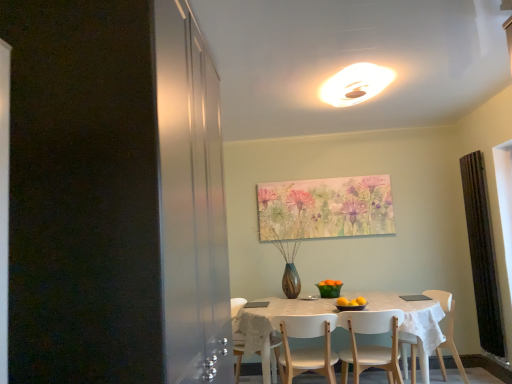
What do you see at coordinates (413, 322) in the screenshot?
I see `white glossy table at center` at bounding box center [413, 322].

Describe the element at coordinates (371, 345) in the screenshot. The width and height of the screenshot is (512, 384). I see `white matte chair at lower center, which appears as the 2th chair when viewed from the right` at that location.

Identify the location of black textured curtain at right. This screenshot has width=512, height=384. (482, 254).

What is the approximate height of white wood chair at center, the 3th chair in the right-to-left sequence?

white wood chair at center, the 3th chair in the right-to-left sequence, is 24.96 inches in height.

I want to click on white glossy table at center, so click(x=413, y=322).

Which object is thinner, white matte chair at lower center, which appears as the 2th chair when viewed from the right, or white glossy table at center?

Thinner between the two is white matte chair at lower center, which appears as the 2th chair when viewed from the right.

Does point (392, 327) lie behind point (268, 359)?

Yes, point (392, 327) is farther from viewer.

Is white matte chair at lower center, marked as the 2th chair in a left-to-right arrangement, to the left or to the right of white glossy table at center in the image?

white matte chair at lower center, marked as the 2th chair in a left-to-right arrangement, is to the right of white glossy table at center.

From a real-world perspective, is white matte chair at lower center, marked as the 2th chair in a left-to-right arrangement, positioned over white glossy table at center based on gravity?

Correct, in the physical world, white matte chair at lower center, marked as the 2th chair in a left-to-right arrangement, is higher than white glossy table at center.

Is white matte chair at lower right, acting as the third chair starting from the left, aimed at white glossy light fixture at upper center?

A: No.

From a real-world perspective, relative to white glossy light fixture at upper center, is white matte chair at lower right, acting as the 1th chair starting from the right, vertically above or below?

From a real-world perspective, white matte chair at lower right, acting as the 1th chair starting from the right, is physically below white glossy light fixture at upper center.

Which of these two, white matte chair at lower right, acting as the third chair starting from the left, or white glossy light fixture at upper center, is wider?

white glossy light fixture at upper center is wider.

Does white matte chair at lower right, acting as the 1th chair starting from the right, have a larger size compared to white glossy light fixture at upper center?

Correct, white matte chair at lower right, acting as the 1th chair starting from the right, is larger in size than white glossy light fixture at upper center.

From the picture: Between black textured curtain at right and white glossy light fixture at upper center, which one has less height?

white glossy light fixture at upper center.

How different are the orientations of black textured curtain at right and white glossy light fixture at upper center in degrees?

91.5 degrees separate the facing orientations of black textured curtain at right and white glossy light fixture at upper center.

How far apart are black textured curtain at right and white glossy light fixture at upper center?

A distance of 5.77 feet exists between black textured curtain at right and white glossy light fixture at upper center.

Which object is closer to the camera taking this photo, black textured curtain at right or white glossy light fixture at upper center?

white glossy light fixture at upper center is in front.

Can white matte chair at lower right, acting as the 1th chair starting from the right, be found inside white glossy light fixture at upper center?

Definitely not — white matte chair at lower right, acting as the 1th chair starting from the right, is not inside white glossy light fixture at upper center.

From a real-world perspective, is white glossy light fixture at upper center physically above white matte chair at lower right, acting as the third chair starting from the left?

Indeed, from a real-world perspective, white glossy light fixture at upper center stands above white matte chair at lower right, acting as the third chair starting from the left.

Could you measure the distance between white glossy light fixture at upper center and white matte chair at lower right, acting as the third chair starting from the left?

white glossy light fixture at upper center is 1.97 meters away from white matte chair at lower right, acting as the third chair starting from the left.

Does white glossy light fixture at upper center have a greater height compared to white matte chair at lower right, acting as the third chair starting from the left?

In fact, white glossy light fixture at upper center may be shorter than white matte chair at lower right, acting as the third chair starting from the left.

In order to click on the 2nd chair below when counting from the watercolor canvas at upper center (from the image's perspective) in this screenshot , I will do `click(306, 348)`.

Is white wood chair at center, the 3th chair in the right-to-left sequence, aimed at watercolor canvas at upper center?

No, white wood chair at center, the 3th chair in the right-to-left sequence, is not aimed at watercolor canvas at upper center.

Who is smaller, white wood chair at center, the 3th chair in the right-to-left sequence, or watercolor canvas at upper center?

watercolor canvas at upper center.

Which object is positioned more to the left, white wood chair at center, the 3th chair in the right-to-left sequence, or watercolor canvas at upper center?

Positioned to the left is white wood chair at center, the 3th chair in the right-to-left sequence.

From a real-world perspective, who is located lower, white glossy table at center or watercolor canvas at upper center?

In real-world perspective, white glossy table at center is lower.

Is white glossy table at center positioned with its back to watercolor canvas at upper center?

white glossy table at center does not have its back to watercolor canvas at upper center.

Would you say watercolor canvas at upper center is part of white glossy table at center's contents?

Definitely not — watercolor canvas at upper center is not inside white glossy table at center.

Which of these two, white glossy table at center or watercolor canvas at upper center, is bigger?

white glossy table at center.

Considering the relative sizes of watercolor canvas at upper center and white matte chair at lower right, acting as the 1th chair starting from the right, in the image provided, is watercolor canvas at upper center smaller than white matte chair at lower right, acting as the 1th chair starting from the right,?

Yes.

From the watercolor canvas at upper center, count 1st chairs forward and point to it. Please provide its 2D coordinates.

[(447, 331)]

Does watercolor canvas at upper center turn towards white matte chair at lower right, acting as the 1th chair starting from the right?

No, watercolor canvas at upper center does not turn towards white matte chair at lower right, acting as the 1th chair starting from the right.

Between watercolor canvas at upper center and white matte chair at lower right, acting as the third chair starting from the left, which one has less height?

Standing shorter between the two is watercolor canvas at upper center.

Find the location of `chair that is the 3rd object located above the white glossy table at center (from the image's perspective)`. chair that is the 3rd object located above the white glossy table at center (from the image's perspective) is located at coordinates (371, 345).

There is a white glossy light fixture at upper center. Identify the location of the 3rd chair below it (from the image's perspective). This screenshot has width=512, height=384. (447, 331).

In the scene shown: Considering their positions, is watercolor canvas at upper center positioned further to white glossy table at center than white wood chair at center, the 3th chair in the right-to-left sequence?

watercolor canvas at upper center is positioned further to the anchor white glossy table at center.

Which object lies further to the anchor point white glossy table at center, white glossy light fixture at upper center or white wood chair at center, which appears as the 1th chair when viewed from the left?

Among the two, white glossy light fixture at upper center is located further to white glossy table at center.

Which object lies nearer to the anchor point white matte chair at lower right, acting as the third chair starting from the left, white wood chair at center, which appears as the 1th chair when viewed from the left, or black textured curtain at right?

black textured curtain at right.

Looking at this image, looking at the image, which one is located further to white glossy light fixture at upper center, white wood chair at center, the 3th chair in the right-to-left sequence, or watercolor canvas at upper center?

Based on the image, white wood chair at center, the 3th chair in the right-to-left sequence, appears to be further to white glossy light fixture at upper center.

When comparing their distances from white glossy light fixture at upper center, does white wood chair at center, which appears as the 1th chair when viewed from the left, or white glossy table at center seem closer?

Based on the image, white glossy table at center appears to be nearer to white glossy light fixture at upper center.

From the image, which object appears to be nearer to white glossy light fixture at upper center, white glossy table at center or white matte chair at lower center, marked as the 2th chair in a left-to-right arrangement?

white glossy table at center lies closer to white glossy light fixture at upper center than the other object.

Which object lies further to the anchor point white glossy table at center, white wood chair at center, which appears as the 1th chair when viewed from the left, or white matte chair at lower center, marked as the 2th chair in a left-to-right arrangement?

Among the two, white matte chair at lower center, marked as the 2th chair in a left-to-right arrangement, is located further to white glossy table at center.

Which object lies nearer to the anchor point white wood chair at center, the 3th chair in the right-to-left sequence, white matte chair at lower right, acting as the 1th chair starting from the right, or white glossy light fixture at upper center?

white matte chair at lower right, acting as the 1th chair starting from the right.

What are the coordinates of `chair positioned between white wood chair at center, the 3th chair in the right-to-left sequence, and watercolor canvas at upper center from near to far` in the screenshot? It's located at (447, 331).

In order to click on kitchen & dining room table positioned between white matte chair at lower center, marked as the 2th chair in a left-to-right arrangement, and watercolor canvas at upper center from near to far in this screenshot , I will do `click(413, 322)`.

I want to click on chair between white wood chair at center, which appears as the 1th chair when viewed from the left, and white matte chair at lower right, acting as the third chair starting from the left, from left to right, so click(371, 345).

Locate an element on the screen. The width and height of the screenshot is (512, 384). curtain positioned between white matte chair at lower center, marked as the 2th chair in a left-to-right arrangement, and watercolor canvas at upper center from near to far is located at coordinates (482, 254).